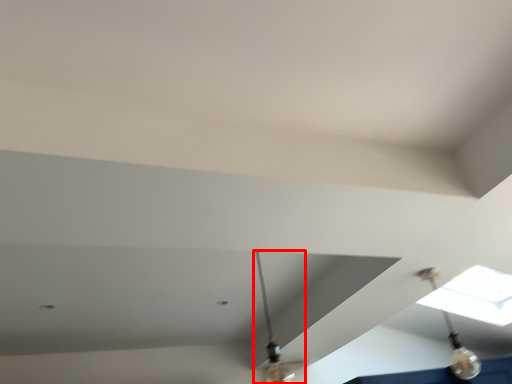
Question: From the image's perspective, what is the correct spatial positioning of lamp (annotated by the red box) in reference to light fixture?

Choices:
 (A) below
 (B) above

Answer: (B)